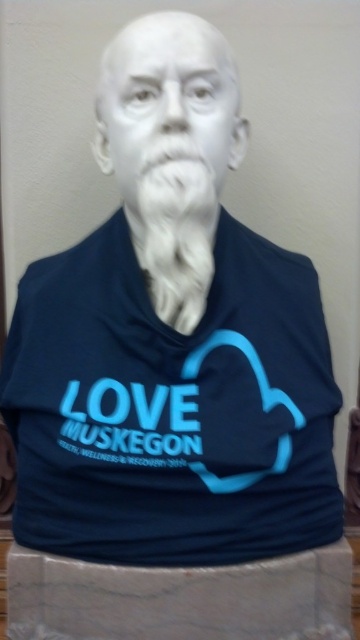
Question: Is matte blue jersey at center further to camera compared to white marble bust at center?

Choices:
 (A) no
 (B) yes

Answer: (B)

Question: Which of these objects is positioned closest to the white marble bust at center?

Choices:
 (A) matte blue jersey at center
 (B) white fluffy beard at center

Answer: (B)

Question: Which is nearer to the matte blue jersey at center?

Choices:
 (A) white fluffy beard at center
 (B) white marble bust at center

Answer: (A)

Question: Which point appears farthest from the camera in this image?

Choices:
 (A) (146, 29)
 (B) (204, 164)
 (C) (234, 280)

Answer: (C)

Question: Is white marble bust at center below white fluffy beard at center?

Choices:
 (A) no
 (B) yes

Answer: (A)

Question: Does white marble bust at center lie behind white fluffy beard at center?

Choices:
 (A) no
 (B) yes

Answer: (A)